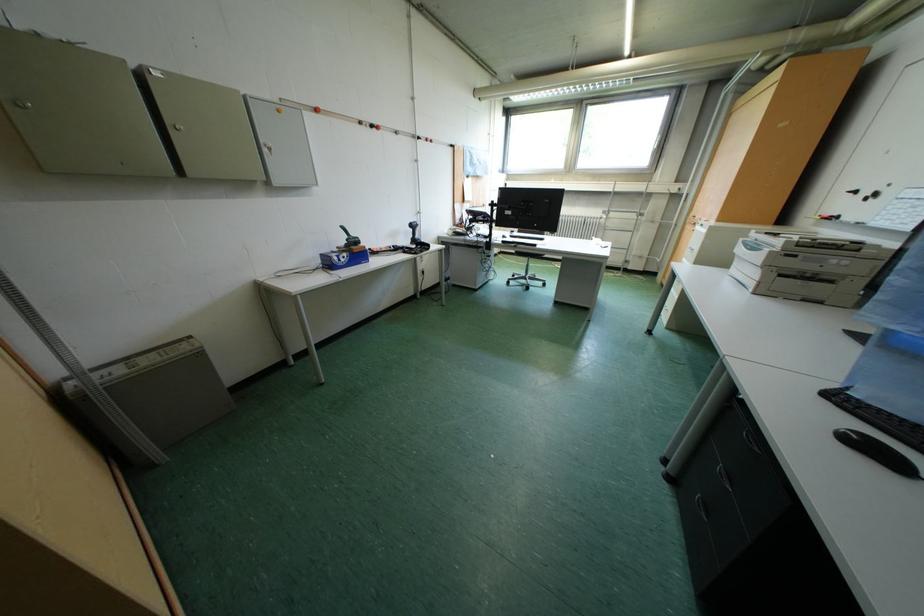
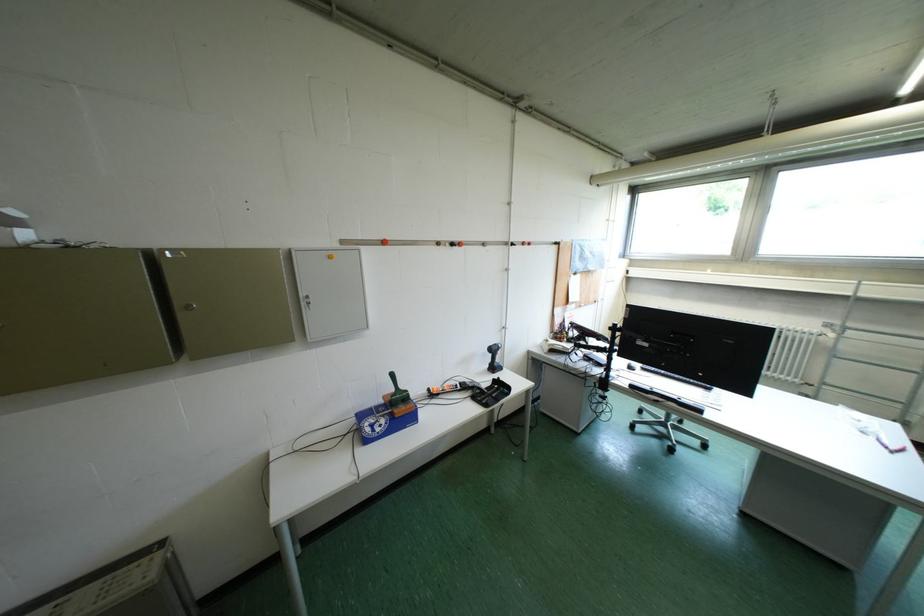
Question: What movement of the cameraman would produce the second image?

Choices:
 (A) Left
 (B) Right
 (C) Forward
 (D) Backward

Answer: (C)